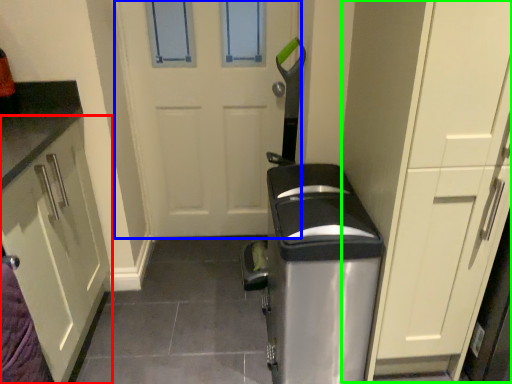
Question: Which object is positioned closest to cabinetry (highlighted by a red box)? Select from door (highlighted by a blue box) and dresser (highlighted by a green box).

Choices:
 (A) door
 (B) dresser

Answer: (A)